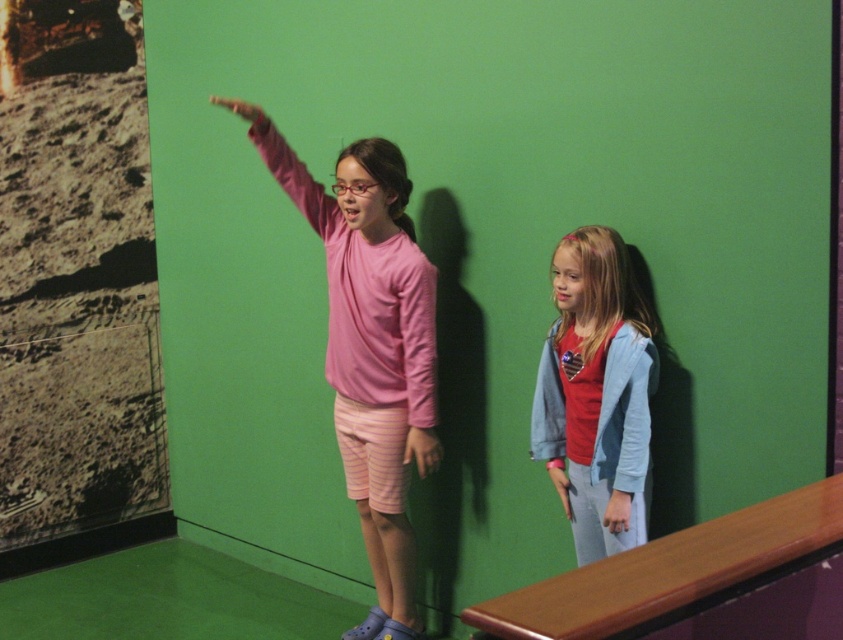
Between pink matte long-sleeve shirt at center and pink fabric arm at upper center, which one is positioned higher?

pink fabric arm at upper center

Between point (414, 380) and point (323, 225), which one is positioned in front?

Positioned in front is point (414, 380).

At what (x,y) coordinates should I click in order to perform the action: click on pink matte long-sleeve shirt at center. Please return your answer as a coordinate pair (x, y). This screenshot has height=640, width=843. Looking at the image, I should click on (419, 364).

Is light blue denim jacket at lower right thinner than light blue fabric at lower right?

Incorrect, light blue denim jacket at lower right's width is not less than light blue fabric at lower right's.

Does light blue denim jacket at lower right have a greater height compared to light blue fabric at lower right?

Yes.

Where is `light blue denim jacket at lower right`? The height and width of the screenshot is (640, 843). light blue denim jacket at lower right is located at coordinates (595, 394).

Where is `light blue denim jacket at lower right`? The height and width of the screenshot is (640, 843). light blue denim jacket at lower right is located at coordinates (595, 394).

Can you confirm if light blue denim jacket at lower right is positioned above pink matte long-sleeve shirt at center?

No.

Which of these two, light blue denim jacket at lower right or pink matte long-sleeve shirt at center, stands shorter?

With less height is pink matte long-sleeve shirt at center.

Does point (581, 358) lie behind point (438, 444)?

No, it is in front of (438, 444).

Find the location of a particular element. This screenshot has width=843, height=640. light blue denim jacket at lower right is located at coordinates (595, 394).